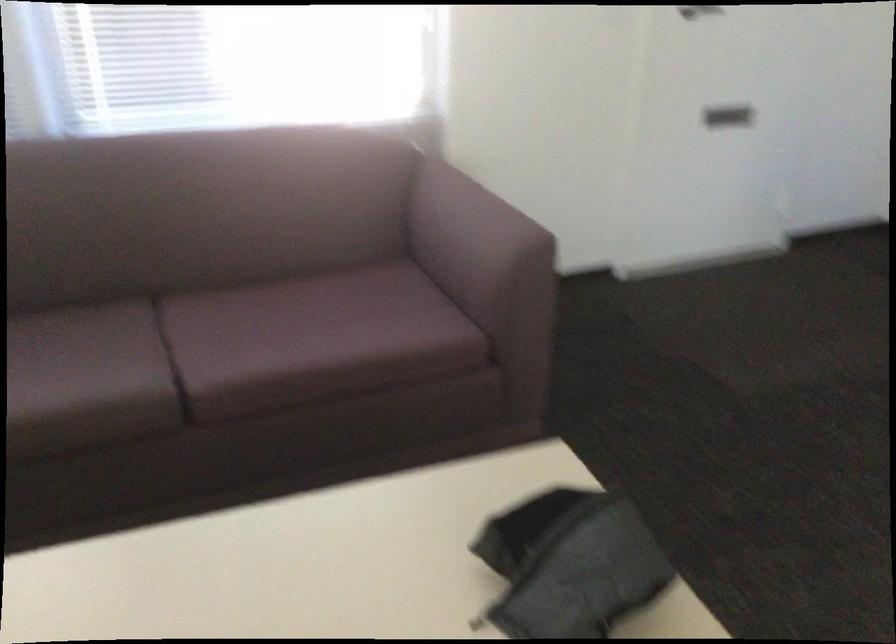
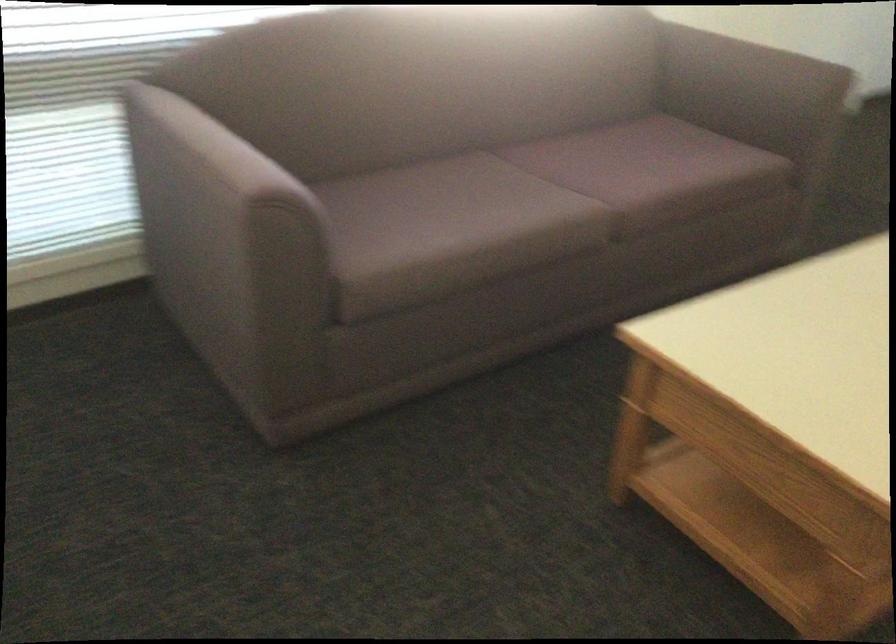
Find the pixel in the second image that matches (467,228) in the first image.

(746, 73)